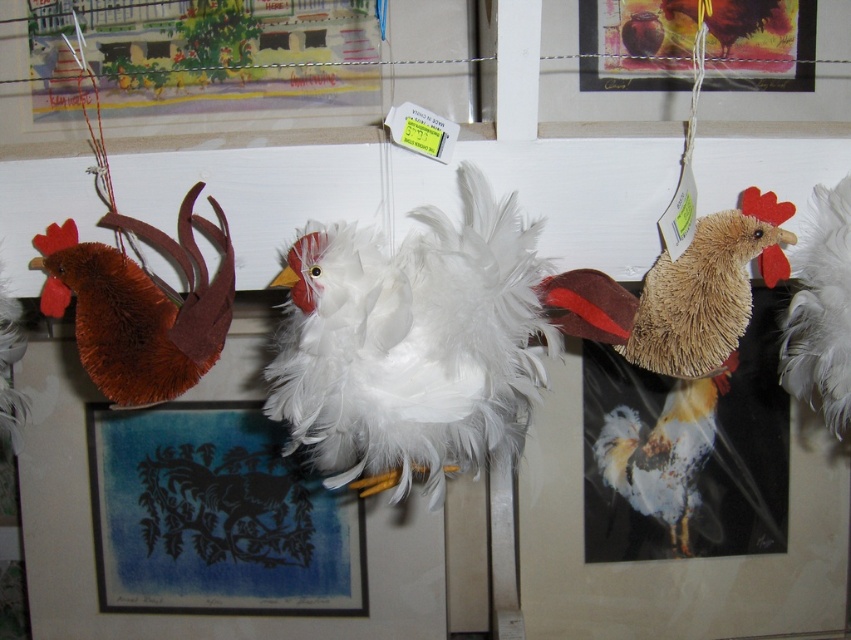
In the scene shown: Can you confirm if brown fuzzy chicken at left is shorter than white fluffy chicken at center?

Yes, brown fuzzy chicken at left is shorter than white fluffy chicken at center.

Is point (220, 337) farther from camera compared to point (690, 422)?

No, (220, 337) is closer to viewer.

At what (x,y) coordinates should I click in order to perform the action: click on brown fuzzy chicken at left. Please return your answer as a coordinate pair (x, y). Looking at the image, I should click on (141, 305).

Is white fluffy chicken at center above white fluffy rooster at center?

Incorrect, white fluffy chicken at center is not positioned above white fluffy rooster at center.

Between point (624, 385) and point (797, 397), which one is positioned behind?

Positioned behind is point (797, 397).

What do you see at coordinates (650, 445) in the screenshot? This screenshot has width=851, height=640. I see `white fluffy chicken at center` at bounding box center [650, 445].

Find the location of a particular element. The width and height of the screenshot is (851, 640). white fluffy chicken at center is located at coordinates (650, 445).

Between point (438, 476) and point (61, 272), which one is positioned in front?

Point (61, 272) is more forward.

Does point (318, 337) lie behind point (49, 260)?

No, it is in front of (49, 260).

Who is more forward, (517, 273) or (164, 392)?

Positioned in front is point (517, 273).

In order to click on white feathered chicken at center in this screenshot , I will do `click(410, 342)`.